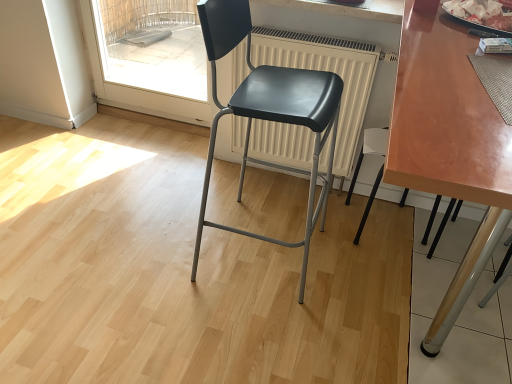
Question: Is matte black chair at center, which is the 1th chair in left-to-right order, spatially inside white matte radiator at center, or outside of it?

Choices:
 (A) outside
 (B) inside

Answer: (A)

Question: Is point (228, 6) closer or farther from the camera than point (338, 39)?

Choices:
 (A) farther
 (B) closer

Answer: (B)

Question: Considering the real-world distances, which object is farthest from the shiny brown table at center?

Choices:
 (A) white matte radiator at center
 (B) matte black chair at lower right, marked as the 1th chair in a right-to-left arrangement
 (C) matte black chair at center, the second chair when ordered from right to left
 (D) transparent glass door at upper left
 (E) shiny silver tray at upper right

Answer: (D)

Question: Based on their relative distances, which object is farther from the matte black chair at lower right, marked as the 1th chair in a right-to-left arrangement?

Choices:
 (A) transparent glass door at upper left
 (B) shiny silver tray at upper right
 (C) matte black chair at center, the second chair when ordered from right to left
 (D) white matte radiator at center
 (E) shiny brown table at center

Answer: (A)